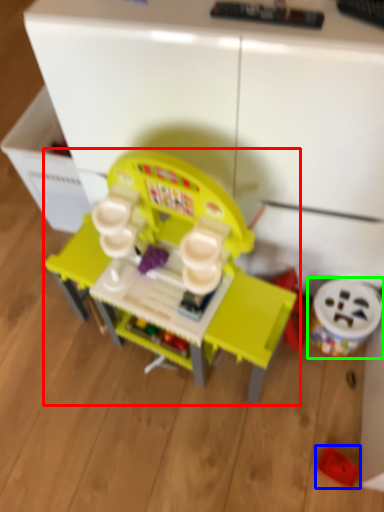
Question: Considering the real-world distances, which object is farthest from toy (highlighted by a red box)? toy (highlighted by a blue box) or toy (highlighted by a green box)?

Choices:
 (A) toy
 (B) toy

Answer: (A)